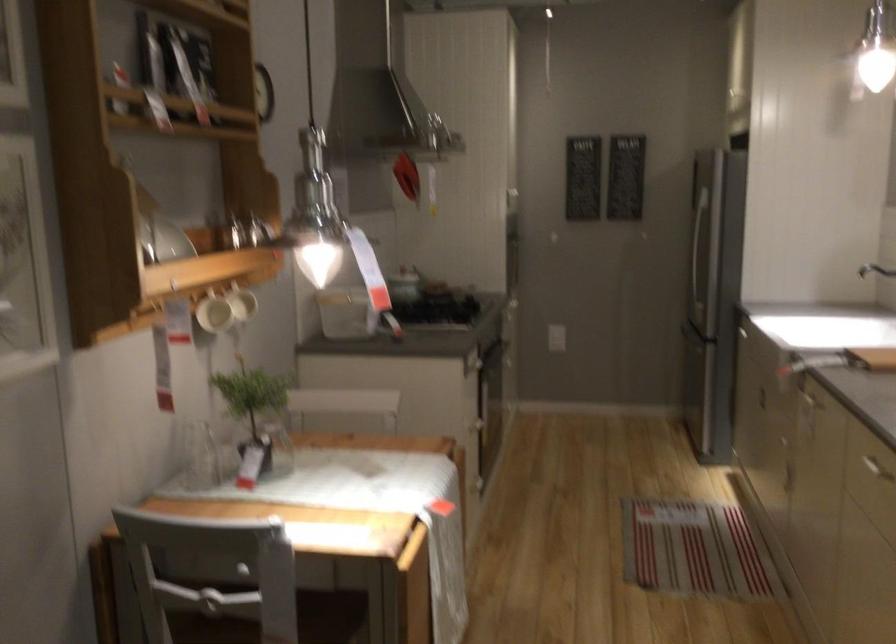
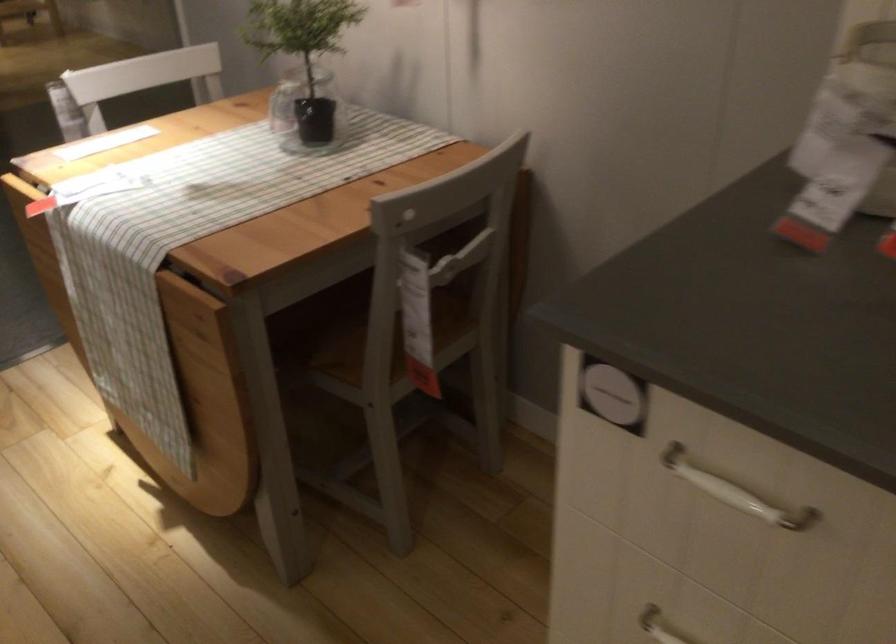
Find the pixel in the second image that matches [478,439] in the first image.

(659, 626)